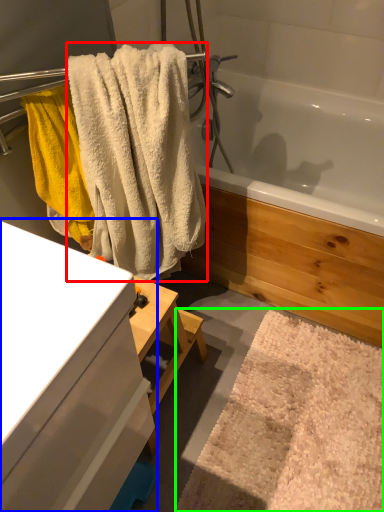
Question: Which object is positioned closest to towel (highlighted by a red box)? Select from bathroom cabinet (highlighted by a blue box) and bath mat (highlighted by a green box).

Choices:
 (A) bathroom cabinet
 (B) bath mat

Answer: (A)